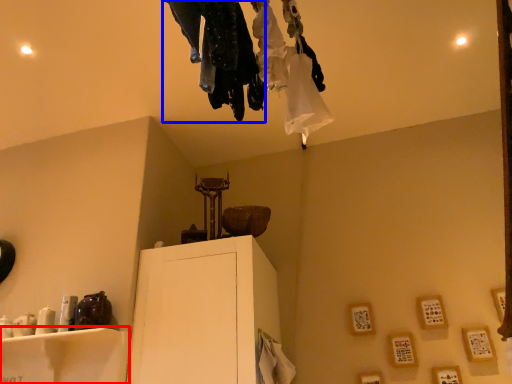
Question: Which object is closer to the camera taking this photo, furniture (highlighted by a red box) or clothing (highlighted by a blue box)?

Choices:
 (A) furniture
 (B) clothing

Answer: (B)